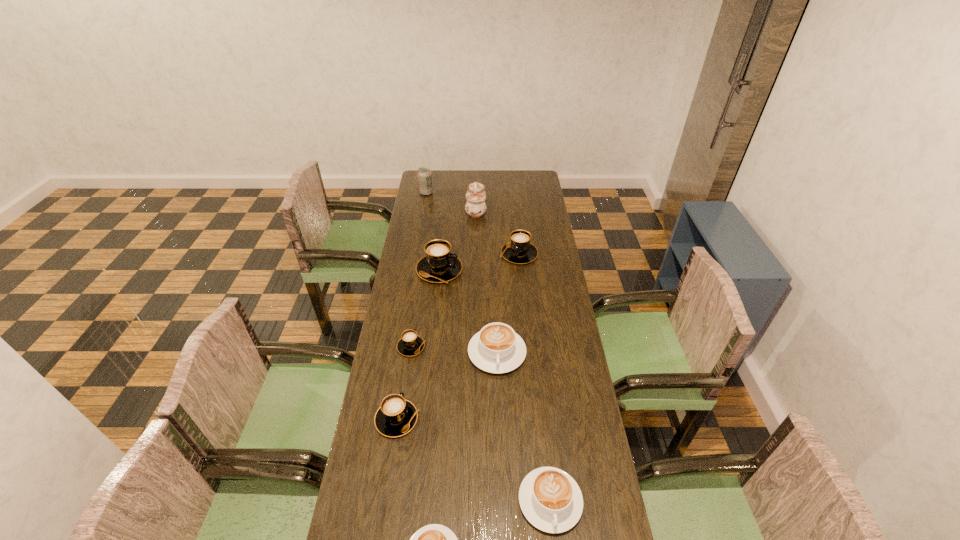
Locate an element on the screen. The height and width of the screenshot is (540, 960). the smallest black cappuccino is located at coordinates (410, 344).

Where is `vacant space situated by the handle of the white chinaware`? vacant space situated by the handle of the white chinaware is located at coordinates (495, 210).

The width and height of the screenshot is (960, 540). Find the location of `blank area located on the right of the soda can`. blank area located on the right of the soda can is located at coordinates (497, 193).

Locate an element on the screen. The width and height of the screenshot is (960, 540). blank area located on the right of the tallest cappuccino is located at coordinates (547, 270).

Where is `blank space located on the left of the third smallest black cappuccino`? This screenshot has height=540, width=960. blank space located on the left of the third smallest black cappuccino is located at coordinates (427, 254).

What are the coordinates of `vacant space located 0.270m on the side of the farthest white cappuccino with the handle` in the screenshot? It's located at (500, 450).

Find the location of a particular element. vacant space positioned on the right of the third biggest black cappuccino is located at coordinates (438, 419).

Identify the location of vacant space located 0.260m on the right of the smallest black cappuccino. (494, 347).

You are a GUI agent. You are given a task and a screenshot of the screen. Output one action in this format:
    pyautogui.click(x=<x>, y=<y>)
    Task: Click on the object present at the far edge
    
    Given the screenshot: What is the action you would take?
    pyautogui.click(x=424, y=174)

I want to click on soda can that is at the left edge, so click(x=424, y=174).